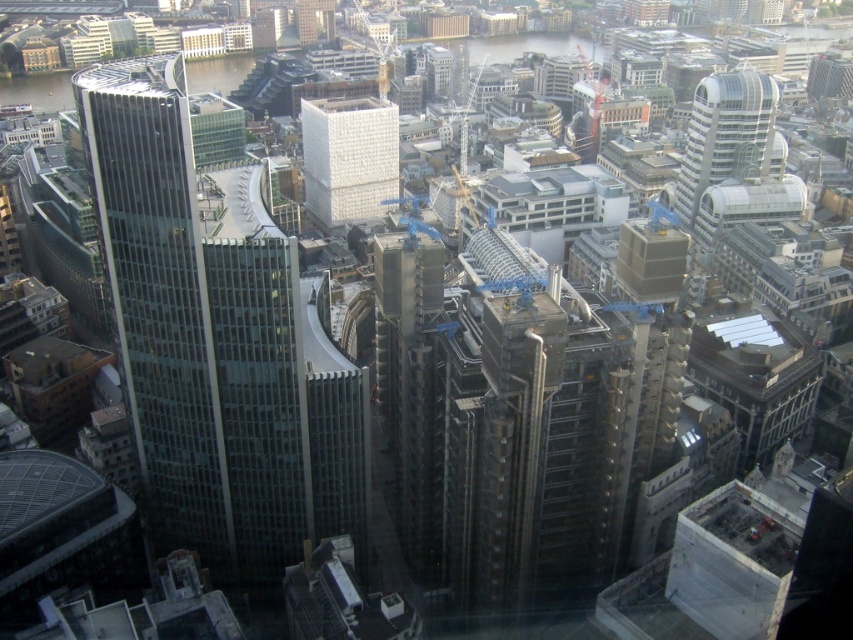
You are a drone pilot flying over the urban area shown in the image. You need to determine the shortest path between the two points marked as point (119, 288) and point (683, 177). Considering their positions relative to the camera, which point should you start your flight from to minimize travel distance?

You should start from point (119, 288) because it is closer to the camera than point (683, 177), so the distance between them would be shorter when starting from the closer point.

You are a drone operator tasked with delivering a package to a glassy steel skyscraper at left. Your drone is currently hovering at point coordinates point (x=160, y=298). Can you confirm if you are already positioned directly above the glassy steel skyscraper at left?

Yes, you are already positioned directly above the glassy steel skyscraper at left because point (x=160, y=298) corresponds to that building.

Based on the scene description, where is the white textured cube at center located in terms of coordinates?

The white textured cube at center is located at point coordinates of (347, 157).